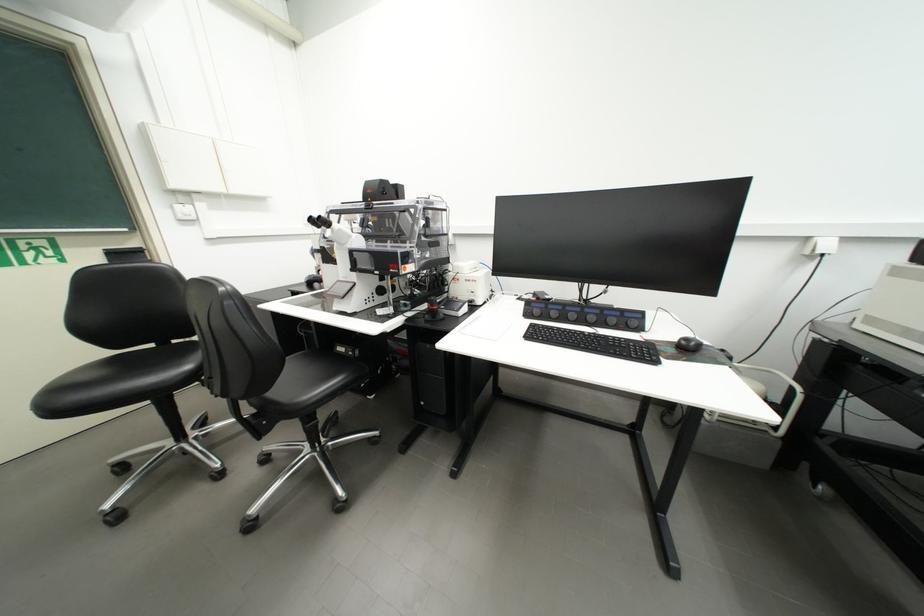
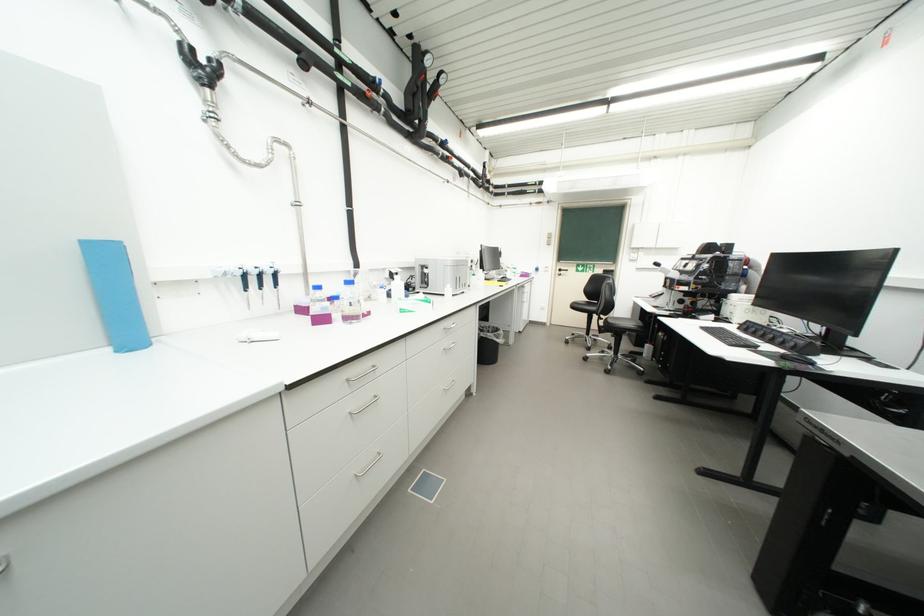
Where in the second image is the point corresponding to the point at 257,413 from the first image?

(610, 325)